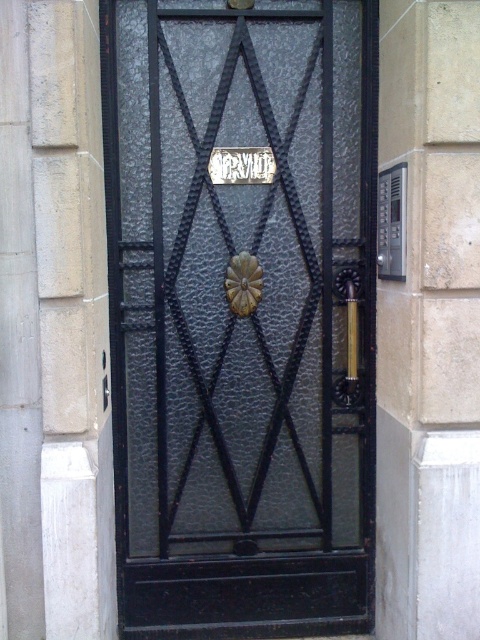
Question: Does black textured metal door at center have a greater width compared to gold textured door handle at center?

Choices:
 (A) yes
 (B) no

Answer: (A)

Question: Which object is the closest to the gold metallic door handle at right?

Choices:
 (A) black textured metal door at center
 (B) gold textured door handle at center

Answer: (B)

Question: Which point appears farthest from the camera in this image?

Choices:
 (A) (245, 312)
 (B) (348, 337)
 (C) (140, 461)

Answer: (C)

Question: Which object is farther from the camera taking this photo?

Choices:
 (A) black textured metal door at center
 (B) gold textured door handle at center
 (C) gold metallic door handle at right

Answer: (B)

Question: From the image, what is the correct spatial relationship of gold metallic door handle at right in relation to gold textured door handle at center?

Choices:
 (A) left
 (B) right

Answer: (B)

Question: Is black textured metal door at center smaller than gold metallic door handle at right?

Choices:
 (A) no
 (B) yes

Answer: (A)